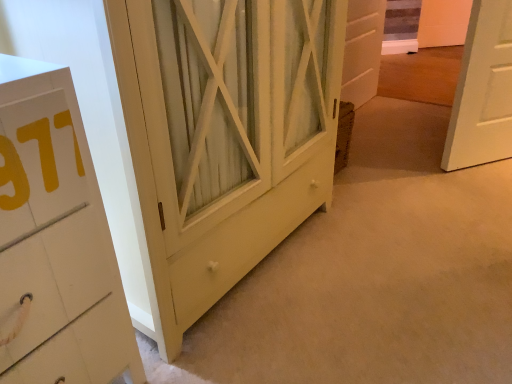
Where is `free space in front of white wood door at center`? Image resolution: width=512 pixels, height=384 pixels. free space in front of white wood door at center is located at coordinates (374, 125).